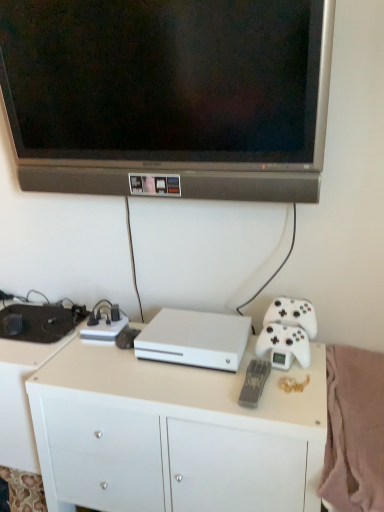
Question: Looking at their shapes, would you say white matte desk at lower left, the second desk from the right, is wider or thinner than white matte desk at center, positioned as the 1th desk in right-to-left order?

Choices:
 (A) thin
 (B) wide

Answer: (B)

Question: Is white matte desk at lower left, the second desk from the right, in front of or behind white matte desk at center, positioned as the 1th desk in right-to-left order, in the image?

Choices:
 (A) behind
 (B) front

Answer: (A)

Question: Which of these objects is positioned closest to the soft pink fleece blanket at lower right?

Choices:
 (A) matte black television at upper center
 (B) white matte desk at lower left, placed as the 1th desk when sorted from left to right
 (C) white matte game controller at right
 (D) white matte console at center
 (E) white matte desk at center, positioned as the 1th desk in right-to-left order

Answer: (C)

Question: Which is nearer to the soft pink fleece blanket at lower right?

Choices:
 (A) white matte game controller at right
 (B) white matte console at center
 (C) white matte desk at center, which ranks as the second desk in left-to-right order
 (D) matte black television at upper center
 (E) white matte desk at lower left, placed as the 1th desk when sorted from left to right

Answer: (A)